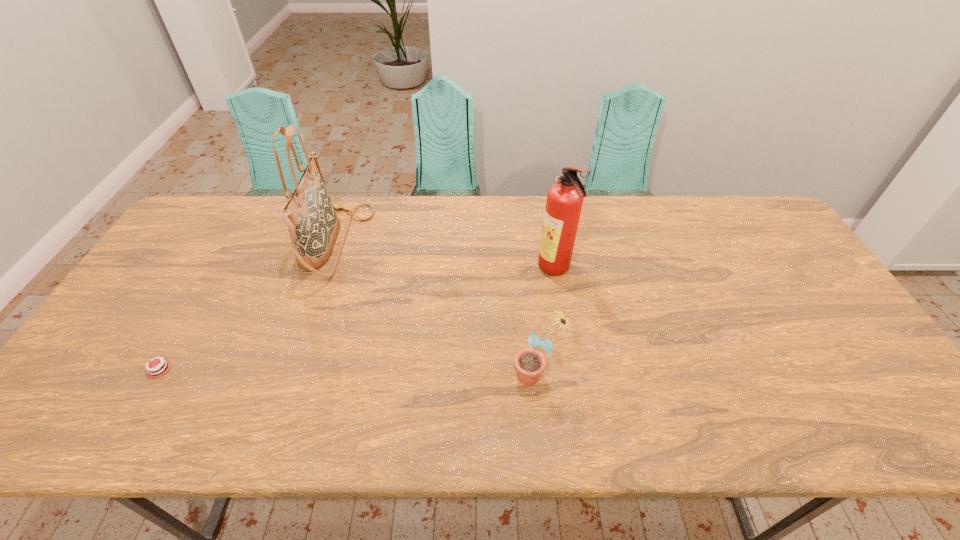
Where is `handbag`? handbag is located at coordinates (313, 225).

This screenshot has height=540, width=960. Find the location of `fire extinguisher`. fire extinguisher is located at coordinates (564, 202).

At what (x,y) coordinates should I click in order to perform the action: click on the second shortest object. Please return your answer as a coordinate pair (x, y). The image size is (960, 540). Looking at the image, I should click on (529, 363).

Locate an element on the screen. This screenshot has width=960, height=540. the shortest object is located at coordinates (156, 369).

The height and width of the screenshot is (540, 960). I want to click on chocolate cake, so click(156, 369).

Where is `vacant space located 0.380m on the front-facing side of the handbag`? vacant space located 0.380m on the front-facing side of the handbag is located at coordinates (488, 243).

Locate an element on the screen. vacant space located on the front-facing side of the fire extinguisher is located at coordinates (504, 270).

Where is `vacant space situated on the front-facing side of the fire extinguisher`? The image size is (960, 540). vacant space situated on the front-facing side of the fire extinguisher is located at coordinates (422, 270).

At what (x,y) coordinates should I click in order to perform the action: click on vacant region located on the front-facing side of the fire extinguisher. Please return your answer as a coordinate pair (x, y). Looking at the image, I should click on (494, 270).

Locate an element on the screen. free point located 0.240m on the flower of the sunflower is located at coordinates (412, 375).